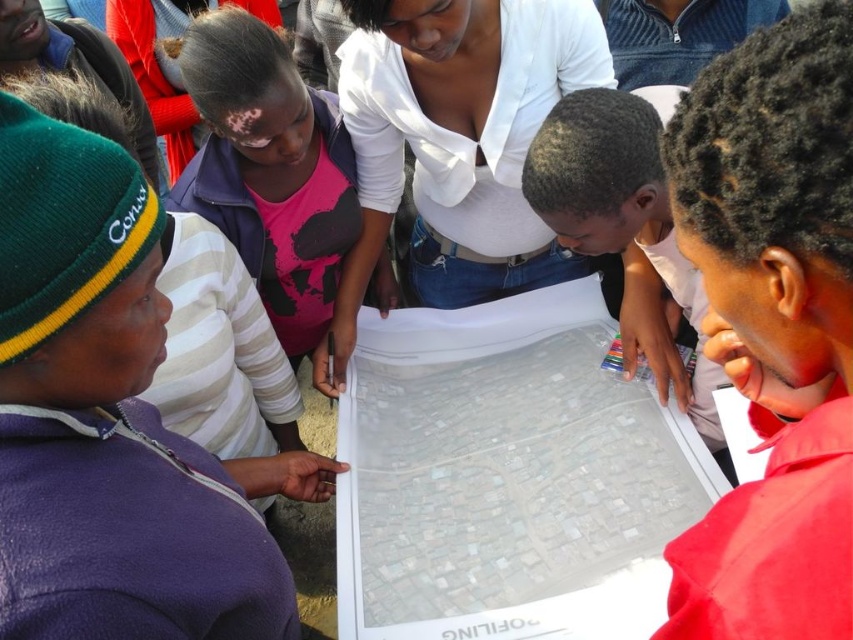
You are a photographer standing in front of the group. You want to take a photo that includes both the smooth red shirt at lower right and the white matte shirt at center. Which shirt will appear larger in the photo?

The smooth red shirt at lower right is closer to the viewer than the white matte shirt at center, so it will appear larger in the photo.

Consider the image. You are a person standing 1.5 meters away from the camera. You want to reach the point marked on the map at point (379, 38). How much further do you need to walk forward to reach that point?

The point at (379, 38) is 1.75 meters away from the camera. Since you are currently 1.5 meters away from the camera, you need to walk an additional 0.25 meters forward to reach that point.